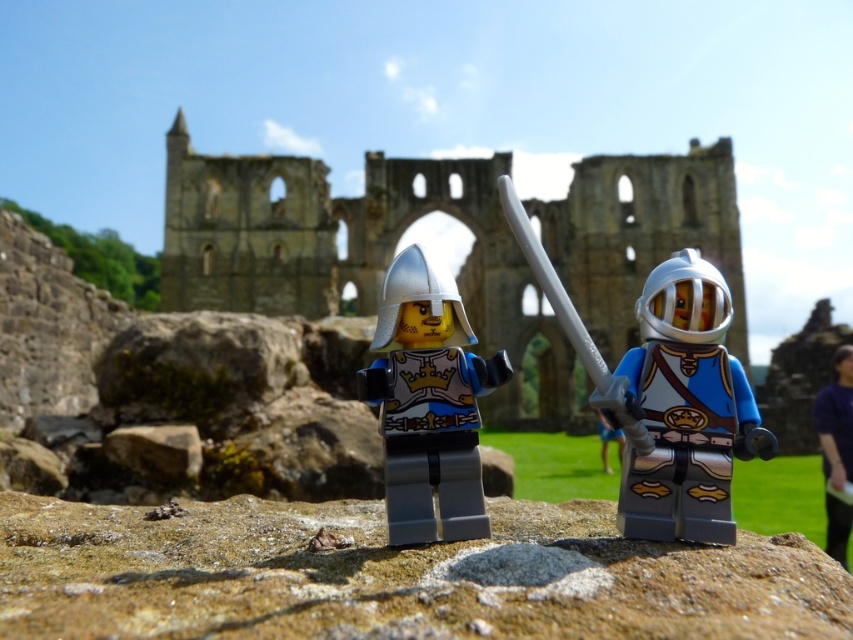
You are a visitor at the historic ruin and notice two helmets on the ground. The shiny silver helmet at center and the silver metallic helmet at center. Which one is directly above the other?

The shiny silver helmet at center is positioned over the silver metallic helmet at center, so the shiny silver helmet at center is directly above the silver metallic helmet at center.